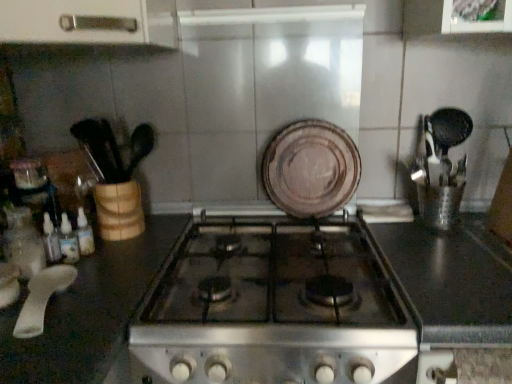
Question: In the image, is white plastic spoon at lower left on the left side or the right side of brown matte plate at center?

Choices:
 (A) left
 (B) right

Answer: (A)

Question: Looking at their shapes, would you say white plastic spoon at lower left is wider or thinner than brown matte plate at center?

Choices:
 (A) thin
 (B) wide

Answer: (B)

Question: Which of these objects is positioned farthest from the white plastic spoon at lower left?

Choices:
 (A) black glass stove at center
 (B) brown matte plate at center

Answer: (B)

Question: Considering the real-world distances, which object is closest to the black glass stove at center?

Choices:
 (A) white plastic spoon at lower left
 (B) brown matte plate at center

Answer: (B)